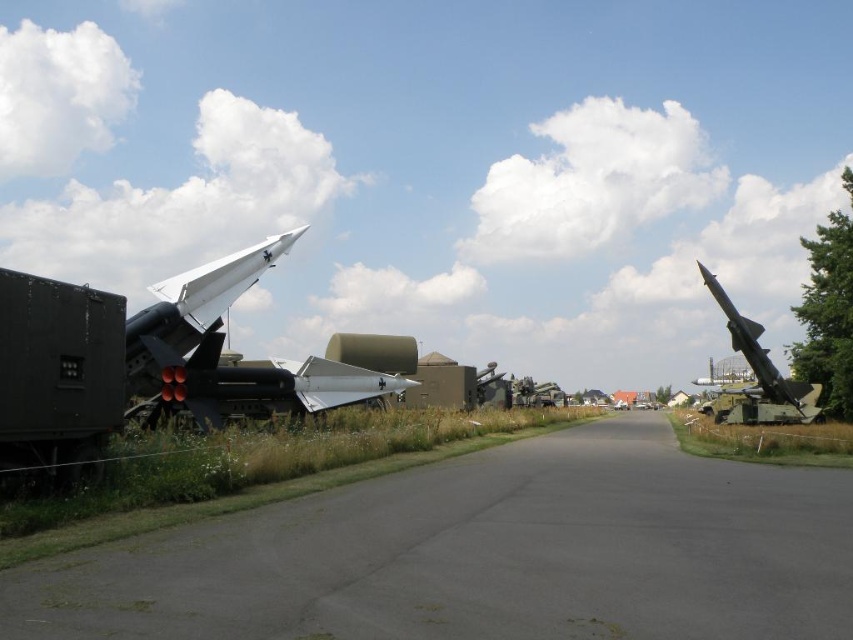
Is white matte missile at left wider than shiny metallic missile at right?

In fact, white matte missile at left might be narrower than shiny metallic missile at right.

From the picture: Who is lower down, white matte missile at left or shiny metallic missile at right?

shiny metallic missile at right

Between point (213, 291) and point (721, 307), which one is positioned in front?

Point (213, 291) is in front.

The image size is (853, 640). I want to click on white matte missile at left, so click(193, 307).